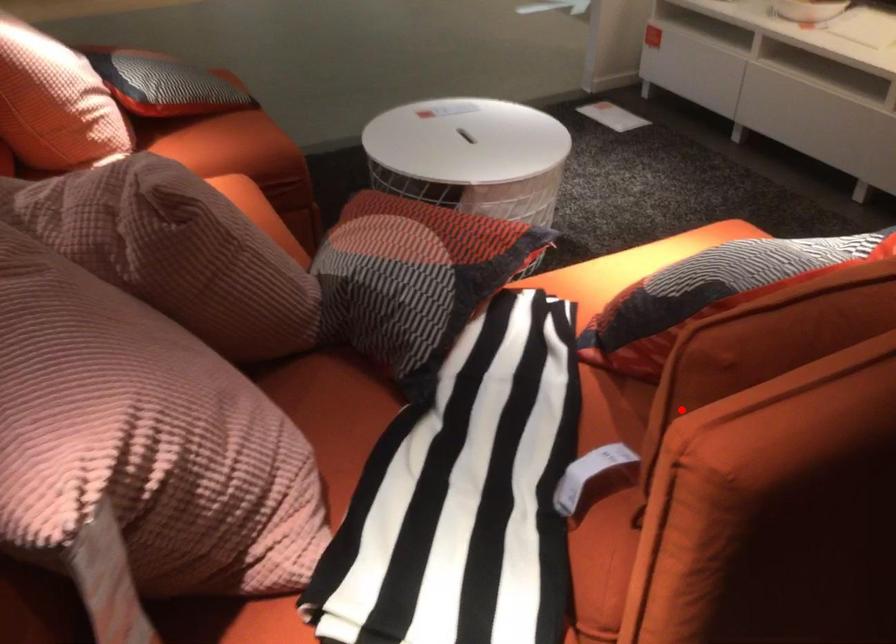
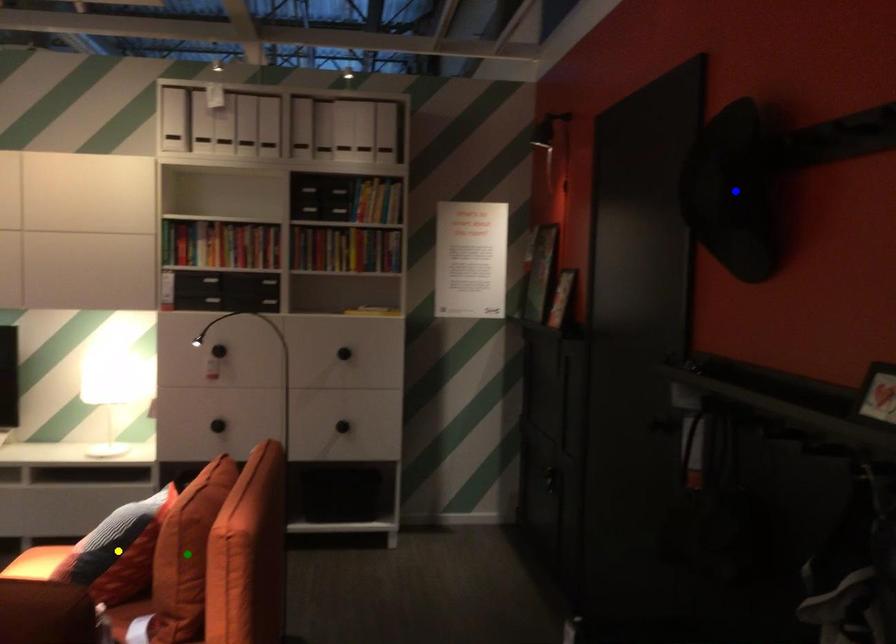
Question: I am providing you with two images of the same scene from different viewpoints. A red point is marked on the first image. You are given multiple points on the second image. Which mark in image 2 goes with the point in image 1?

Choices:
 (A) yellow point
 (B) blue point
 (C) green point

Answer: (C)